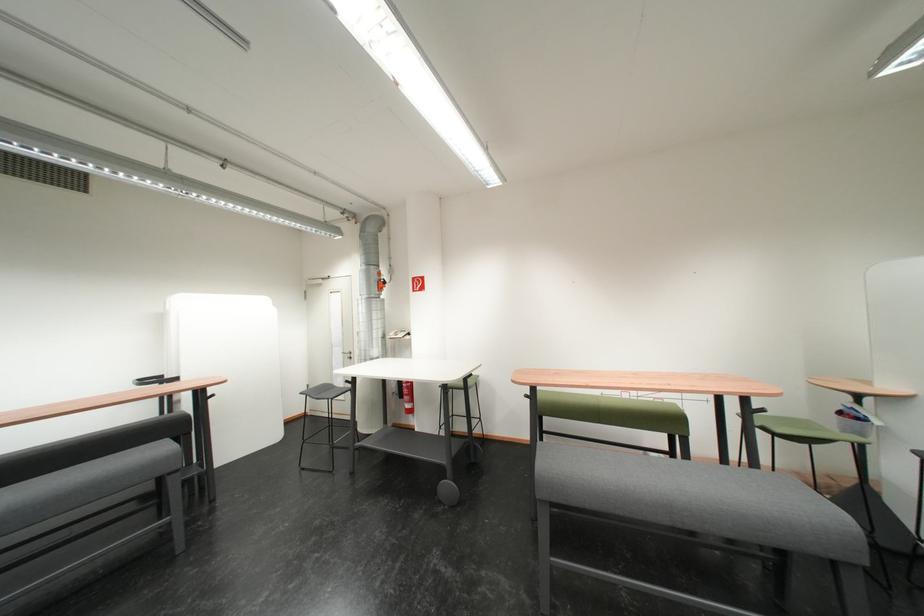
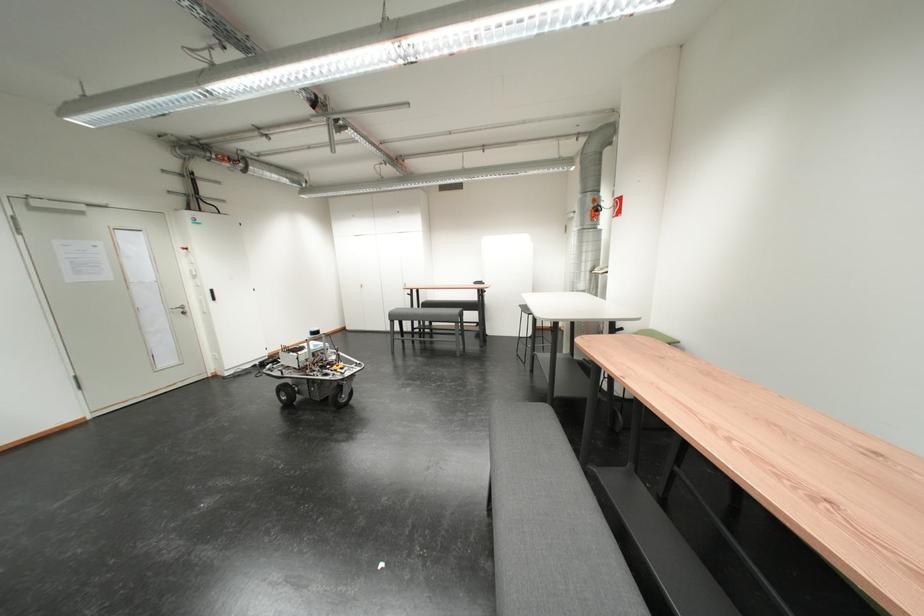
Locate, in the second image, the point that corresponds to pixel 408 568 in the first image.

(494, 419)